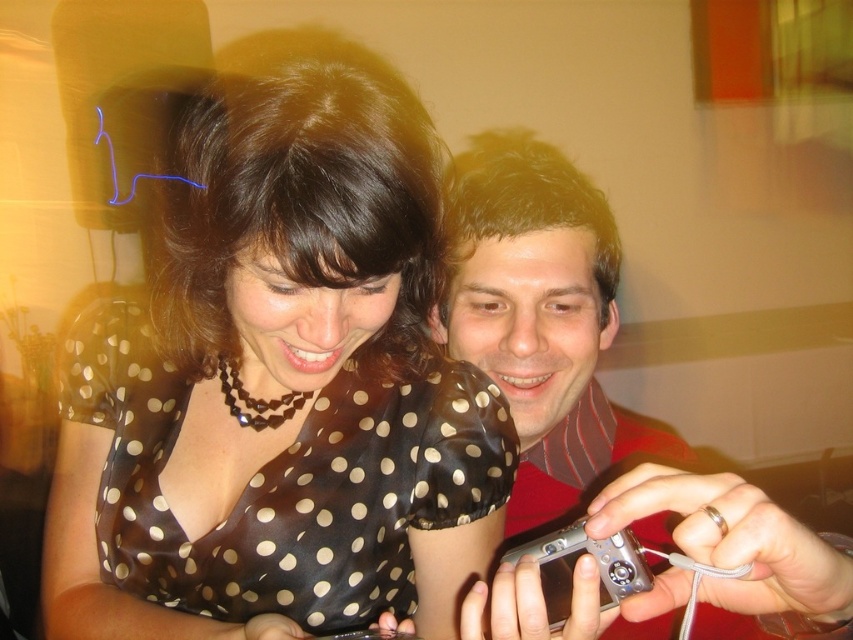
Question: Which point is closer to the camera taking this photo?

Choices:
 (A) (537, 378)
 (B) (212, 492)

Answer: (B)

Question: Does black satin blouse at center appear on the left side of silver metallic camera at center?

Choices:
 (A) no
 (B) yes

Answer: (B)

Question: Is black satin blouse at center wider than silver metallic camera at center?

Choices:
 (A) yes
 (B) no

Answer: (A)

Question: Which point appears closest to the camera in this image?

Choices:
 (A) (251, 129)
 (B) (531, 474)

Answer: (A)

Question: Which of the following is the farthest from the observer?

Choices:
 (A) silver metallic camera at center
 (B) black satin blouse at center

Answer: (A)

Question: Can you confirm if black satin blouse at center is positioned to the right of silver metallic camera at center?

Choices:
 (A) no
 (B) yes

Answer: (A)